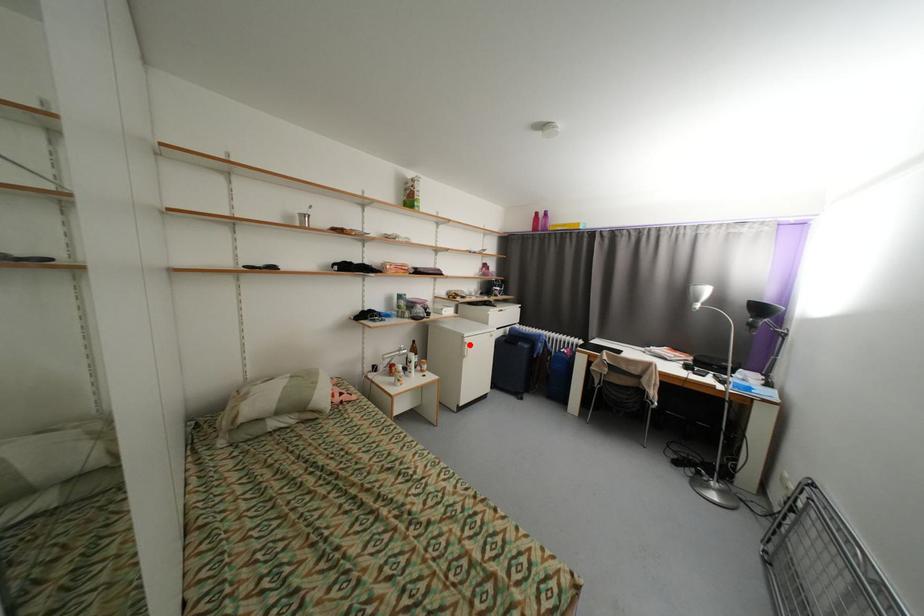
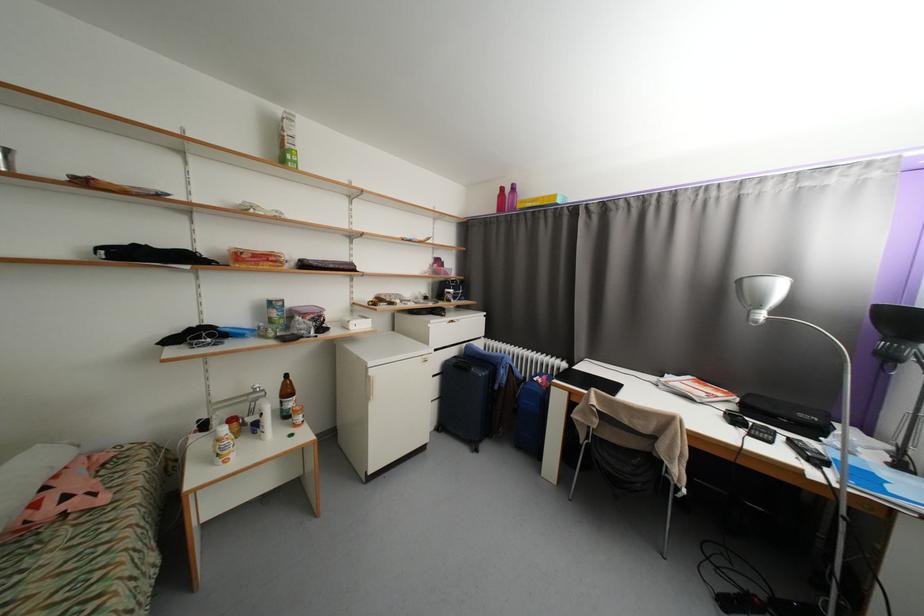
The point at the highlighted location is marked in the first image. Where is the corresponding point in the second image?

(373, 379)